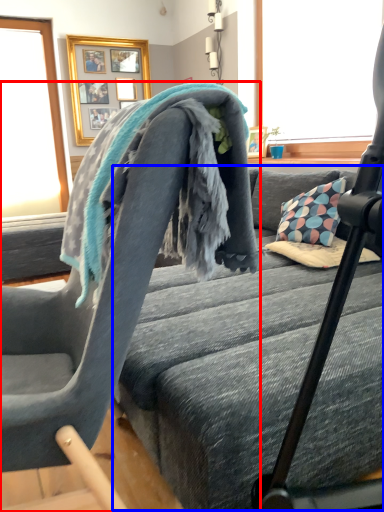
Question: Among these objects, which one is nearest to the camera, chair (highlighted by a red box) or bed frame (highlighted by a blue box)?

Choices:
 (A) chair
 (B) bed frame

Answer: (A)